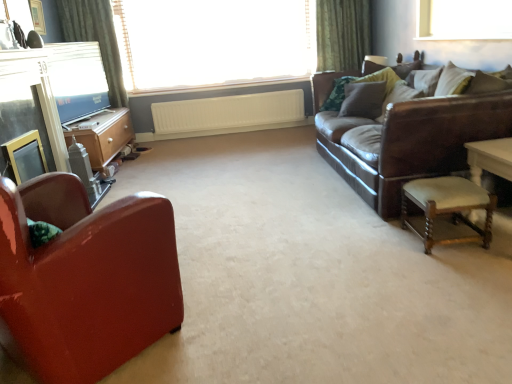
Question: Visually, is green fabric curtain at upper left positioned to the left or to the right of wooden dresser at left?

Choices:
 (A) right
 (B) left

Answer: (B)

Question: Would you say green fabric curtain at upper left is inside or outside wooden dresser at left?

Choices:
 (A) inside
 (B) outside

Answer: (B)

Question: Considering the real-world distances, which object is closest to the velvet brown pillow at upper right, which ranks as the first pillow in right-to-left order?

Choices:
 (A) leather couch at right
 (B) white glass window at upper right, which ranks as the second window in left-to-right order
 (C) glossy red armchair at left
 (D) wooden upholstered stool at right
 (E) velvet brown pillow at upper right, the 1th pillow in the left-to-right sequence

Answer: (E)

Question: Which is nearer to the glossy red armchair at left?

Choices:
 (A) wooden upholstered stool at right
 (B) white textured radiator at center
 (C) velvet brown pillow at upper right, the 1th pillow in the left-to-right sequence
 (D) wooden dresser at left
 (E) leather couch at right

Answer: (A)